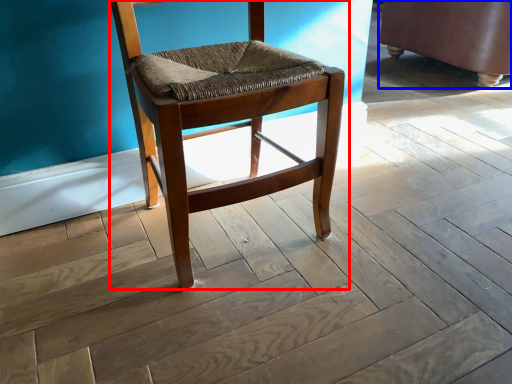
Question: Which object appears closest to the camera in this image, chair (highlighted by a red box) or swivel chair (highlighted by a blue box)?

Choices:
 (A) chair
 (B) swivel chair

Answer: (A)